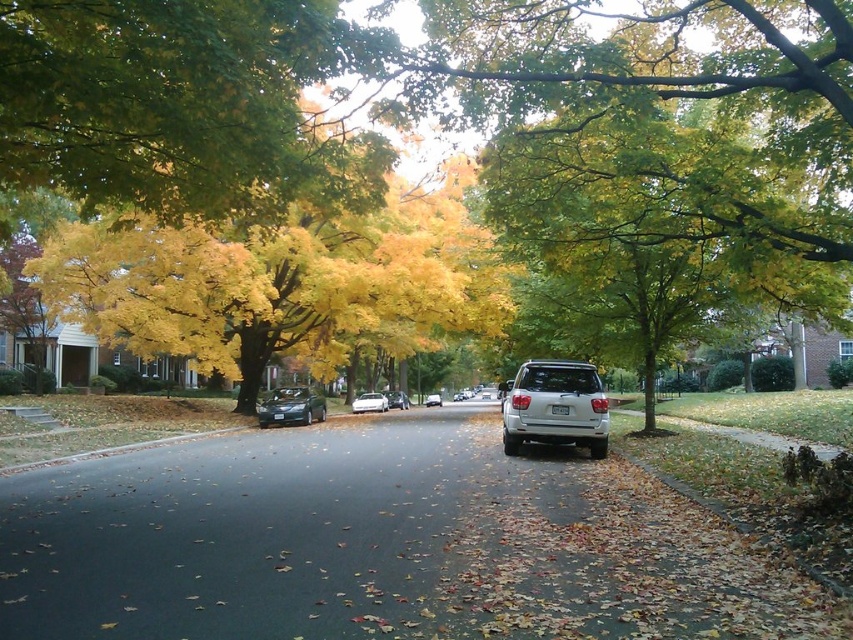
Question: Which object appears farthest from the camera in this image?

Choices:
 (A) white plastic license plate at center
 (B) yellow/golden leaves at center
 (C) shiny black sedan at center
 (D) satin silver sedan at center

Answer: (D)

Question: Is yellow/golden leaves at center wider than shiny black sedan at center?

Choices:
 (A) yes
 (B) no

Answer: (A)

Question: Which point is closer to the camera?

Choices:
 (A) shiny black sedan at center
 (B) white plastic license plate at center

Answer: (B)

Question: Observing the image, what is the correct spatial positioning of shiny black sedan at center in reference to satin silver sedan at center?

Choices:
 (A) below
 (B) above

Answer: (B)

Question: Does yellow/golden leaves at center lie behind satin black sedan at center?

Choices:
 (A) no
 (B) yes

Answer: (A)

Question: Which point is farther from the camera taking this photo?

Choices:
 (A) 596,417
 (B) 404,401
 (C) 323,412

Answer: (B)